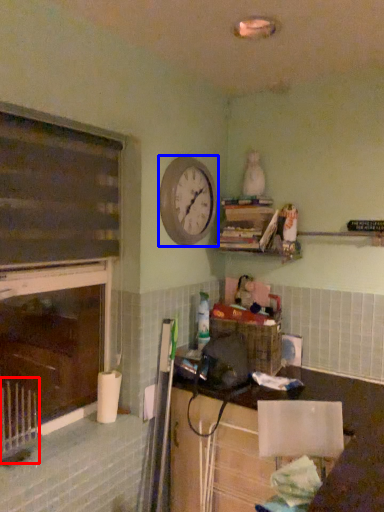
Question: Which point is further to the camera, radiator (highlighted by a red box) or clock (highlighted by a blue box)?

Choices:
 (A) radiator
 (B) clock

Answer: (B)